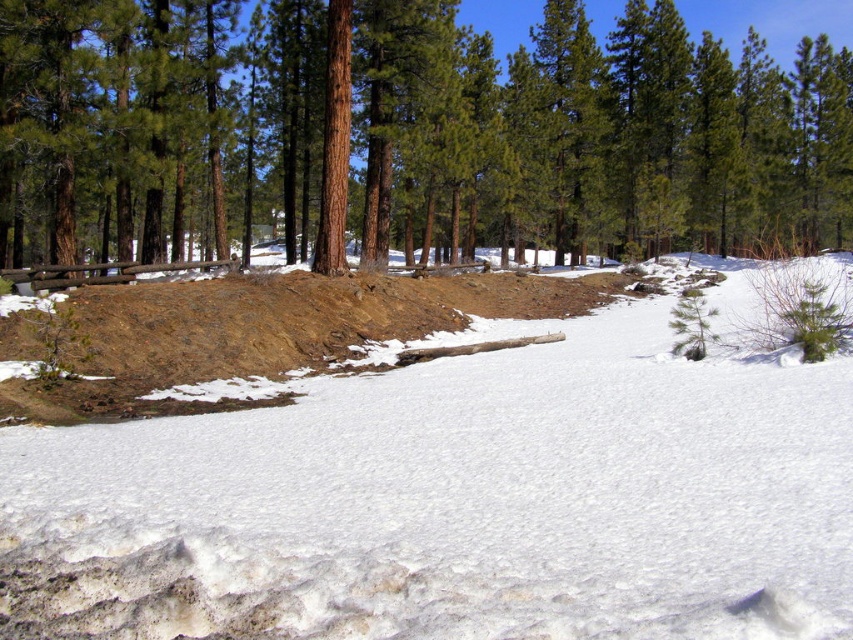
Based on the scene description, which object takes up more area in the image? Please choose between the white fluffy snow at center and the brown textured log at center.

The brown textured log at center occupies more space than the white fluffy snow at center according to the description.

From the picture: You are a hiker who wants to take a photo of the white fluffy snow at center. Where should you position yourself to capture it in the center of your camera frame?

Position yourself directly in front of the white fluffy snow at center, aligning it with the center point of your camera frame at coordinates approximately 0.786 on the x and 0.535 on the y axis.

Based on the photo, you are an environmental scientist analyzing the winter landscape. You need to determine which object occupies a wider area in the scene between the white fluffy snow at center and the brown textured log at center. Which one is wider?

The brown textured log at center is wider than the white fluffy snow at center.